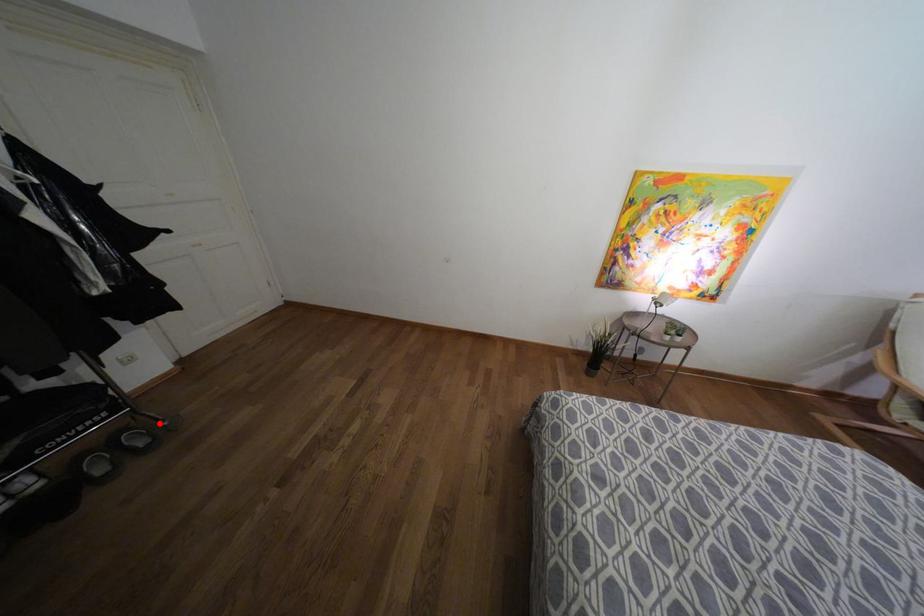
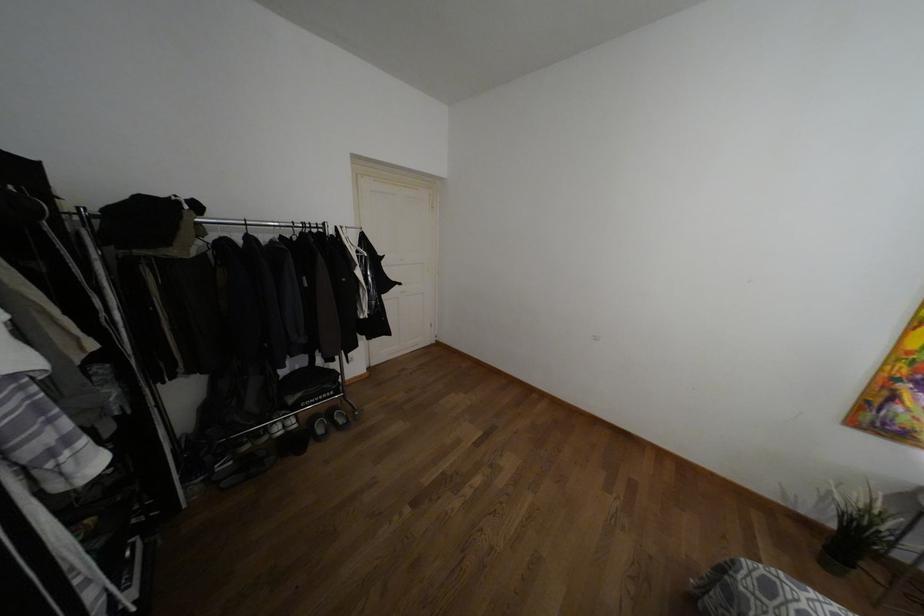
Question: A red point is marked in image1. In image2, is the corresponding 3D point closer to the camera or farther? Reply with the corresponding letter.

Choices:
 (A) The corresponding 3D point is closer.
 (B) The corresponding 3D point is farther.

Answer: (A)